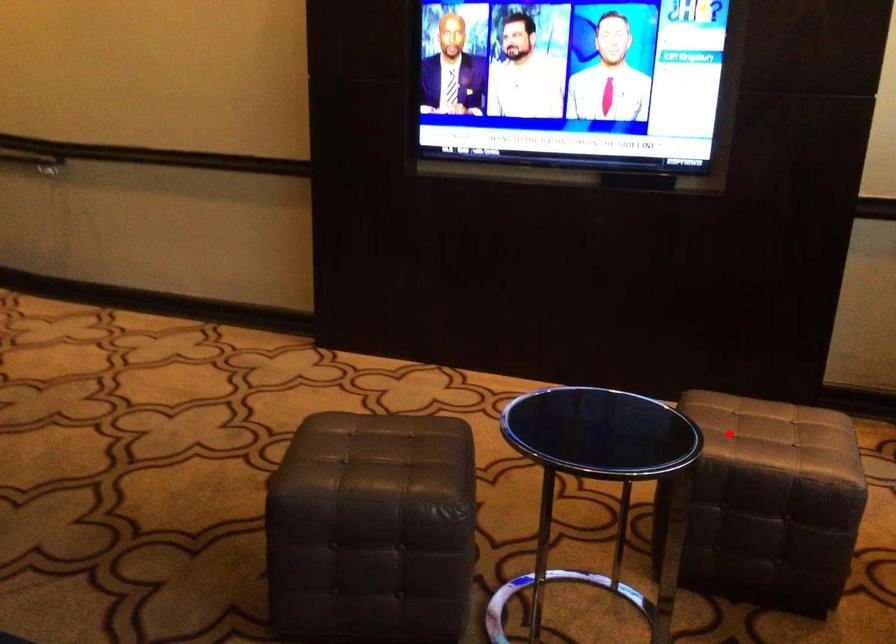
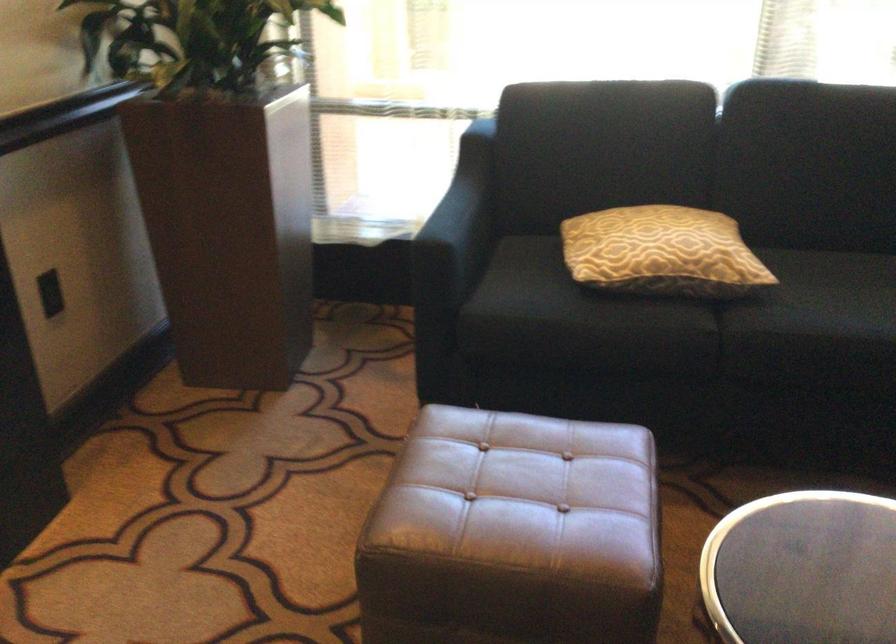
Question: I am providing you with two images of the same scene from different viewpoints. Given a red point in image1, look at the same physical point in image2. Is it:

Choices:
 (A) Closer to the viewpoint
 (B) Farther from the viewpoint

Answer: (A)